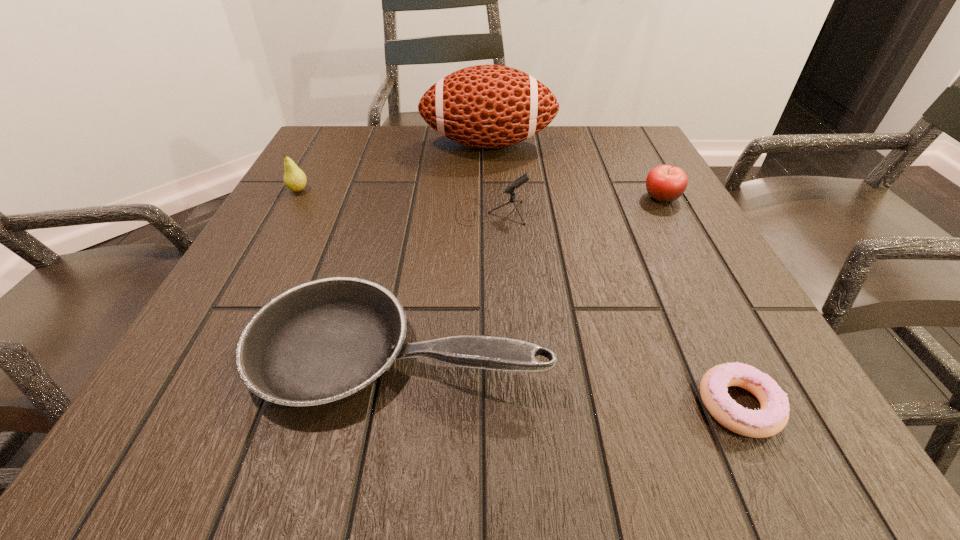
Identify the location of vacant space located on the stand of the microphone. This screenshot has height=540, width=960. (397, 212).

You are a GUI agent. You are given a task and a screenshot of the screen. Output one action in this format:
    pyautogui.click(x=<x>, y=<y>)
    Task: Click on the free space located on the stand of the microphone
    The height and width of the screenshot is (540, 960).
    Given the screenshot: What is the action you would take?
    pyautogui.click(x=334, y=212)

This screenshot has width=960, height=540. I want to click on vacant region located on the back of the apple, so click(638, 154).

You are a GUI agent. You are given a task and a screenshot of the screen. Output one action in this format:
    pyautogui.click(x=<x>, y=<y>)
    Task: Click on the vacant space located 0.310m on the right of the frying pan
    
    Given the screenshot: What is the action you would take?
    pyautogui.click(x=757, y=350)

Where is `free point located on the left of the shortest object`? free point located on the left of the shortest object is located at coordinates (403, 405).

Image resolution: width=960 pixels, height=540 pixels. I want to click on object that is positioned at the far edge, so click(x=485, y=106).

Locate an element on the screen. frying pan that is at the near edge is located at coordinates pyautogui.click(x=321, y=342).

Where is `doughnut positioned at the near edge`? doughnut positioned at the near edge is located at coordinates (773, 416).

Identify the location of pear located in the left edge section of the desktop. The width and height of the screenshot is (960, 540). (295, 179).

Identify the location of frying pan located in the left edge section of the desktop. (321, 342).